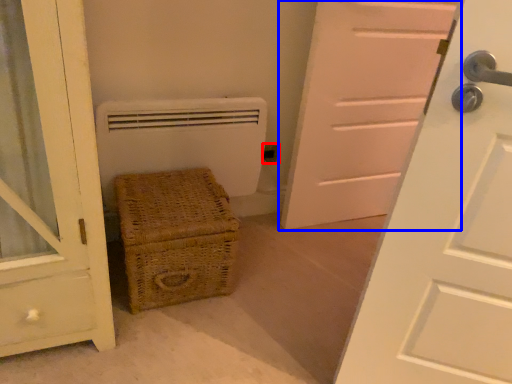
Question: Which of the following is the farthest to the observer, electric outlet (highlighted by a red box) or door (highlighted by a blue box)?

Choices:
 (A) electric outlet
 (B) door

Answer: (A)